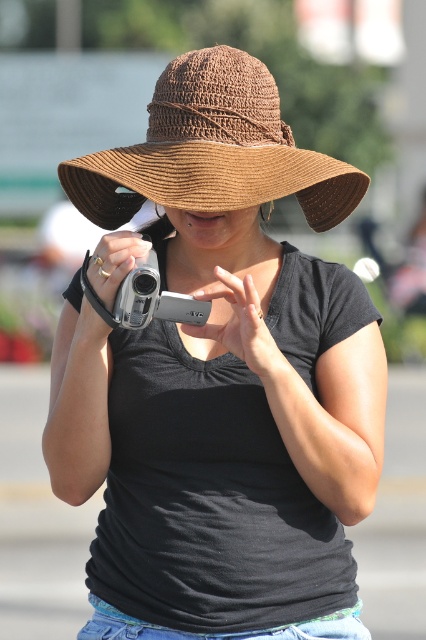
Question: Which point is closer to the camera?

Choices:
 (A) (230, 161)
 (B) (120, 294)

Answer: (B)

Question: Can you confirm if brown straw hat at center is wider than silver metallic camera at center?

Choices:
 (A) yes
 (B) no

Answer: (A)

Question: Is brown straw hat at center smaller than silver metallic camera at center?

Choices:
 (A) no
 (B) yes

Answer: (A)

Question: Which of the following is the closest to the observer?

Choices:
 (A) silver metallic camera at center
 (B) brown straw hat at center

Answer: (A)

Question: Can you confirm if brown straw hat at center is positioned to the left of silver metallic camera at center?

Choices:
 (A) no
 (B) yes

Answer: (A)

Question: Which object is closer to the camera taking this photo?

Choices:
 (A) brown straw hat at center
 (B) silver metallic camera at center

Answer: (B)